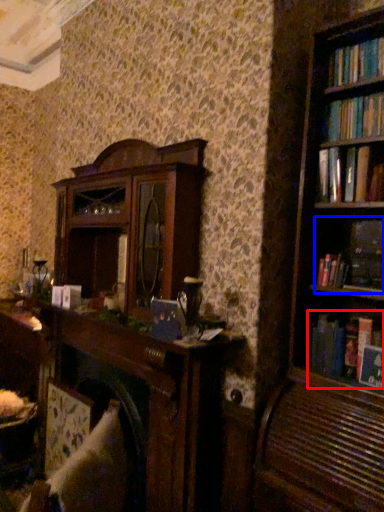
Question: Which object appears farthest to the camera in this image, book (highlighted by a red box) or book (highlighted by a blue box)?

Choices:
 (A) book
 (B) book

Answer: (A)